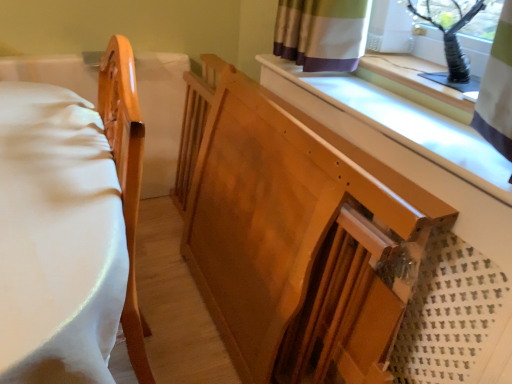
Question: From a real-world perspective, is wooden changing table at center over matte wood bed frame at left?

Choices:
 (A) no
 (B) yes

Answer: (A)

Question: Is wooden changing table at center surrounding matte wood bed frame at left?

Choices:
 (A) no
 (B) yes

Answer: (A)

Question: Can you confirm if wooden changing table at center is positioned to the right of matte wood bed frame at left?

Choices:
 (A) no
 (B) yes

Answer: (B)

Question: Is wooden changing table at center wider than matte wood bed frame at left?

Choices:
 (A) no
 (B) yes

Answer: (A)

Question: Considering the relative sizes of wooden changing table at center and matte wood bed frame at left in the image provided, is wooden changing table at center thinner than matte wood bed frame at left?

Choices:
 (A) no
 (B) yes

Answer: (B)

Question: Is black plastic vase at upper right situated inside wooden changing table at center or outside?

Choices:
 (A) outside
 (B) inside

Answer: (A)

Question: In the image, is black plastic vase at upper right on the left side or the right side of wooden changing table at center?

Choices:
 (A) left
 (B) right

Answer: (B)

Question: Is point (472, 67) positioned closer to the camera than point (369, 271)?

Choices:
 (A) closer
 (B) farther

Answer: (B)

Question: From the image's perspective, is black plastic vase at upper right above or below wooden changing table at center?

Choices:
 (A) below
 (B) above

Answer: (B)

Question: From the image's perspective, is black plastic vase at upper right located above or below matte wood bed frame at left?

Choices:
 (A) below
 (B) above

Answer: (B)

Question: Considering the positions of point (494, 3) and point (133, 360), is point (494, 3) closer or farther from the camera than point (133, 360)?

Choices:
 (A) farther
 (B) closer

Answer: (A)

Question: In terms of width, does black plastic vase at upper right look wider or thinner when compared to matte wood bed frame at left?

Choices:
 (A) thin
 (B) wide

Answer: (A)

Question: In terms of height, does black plastic vase at upper right look taller or shorter compared to matte wood bed frame at left?

Choices:
 (A) tall
 (B) short

Answer: (B)

Question: From the image's perspective, is wooden changing table at center above or below matte wood bed frame at left?

Choices:
 (A) above
 (B) below

Answer: (A)

Question: Is point (288, 147) closer or farther from the camera than point (126, 92)?

Choices:
 (A) closer
 (B) farther

Answer: (B)